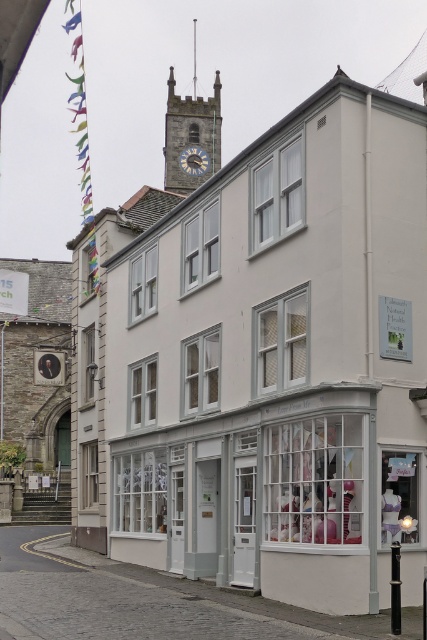
Is point (180, 97) positioned after point (201, 170)?

Yes, it is.

Find the location of a particular element. This screenshot has width=427, height=640. matte gray stone clock tower at upper center is located at coordinates (190, 134).

Who is more forward, (198, 145) or (195, 164)?

Positioned in front is point (195, 164).

This screenshot has width=427, height=640. Identify the location of matte gray stone clock tower at upper center. (190, 134).